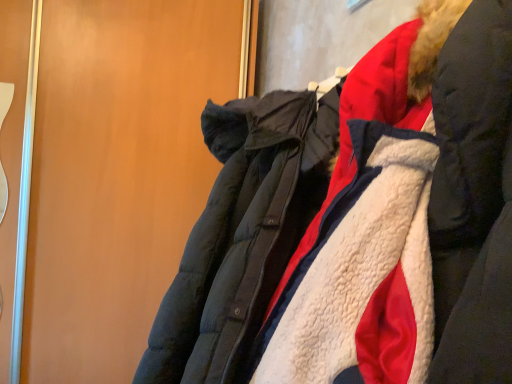
Question: From a real-world perspective, is matte black coat at right above or below white fleece jacket at center?

Choices:
 (A) above
 (B) below

Answer: (A)

Question: Is matte black coat at right taller or shorter than white fleece jacket at center?

Choices:
 (A) tall
 (B) short

Answer: (A)

Question: Is matte black coat at right situated inside white fleece jacket at center or outside?

Choices:
 (A) outside
 (B) inside

Answer: (A)

Question: From the image's perspective, is white fleece jacket at center positioned above or below matte black coat at right?

Choices:
 (A) below
 (B) above

Answer: (A)

Question: Considering the positions of white fleece jacket at center and matte black coat at right in the image, is white fleece jacket at center bigger or smaller than matte black coat at right?

Choices:
 (A) small
 (B) big

Answer: (A)

Question: Relative to matte black coat at right, is white fleece jacket at center in front or behind?

Choices:
 (A) behind
 (B) front

Answer: (B)

Question: In terms of height, does white fleece jacket at center look taller or shorter compared to matte black coat at right?

Choices:
 (A) short
 (B) tall

Answer: (A)